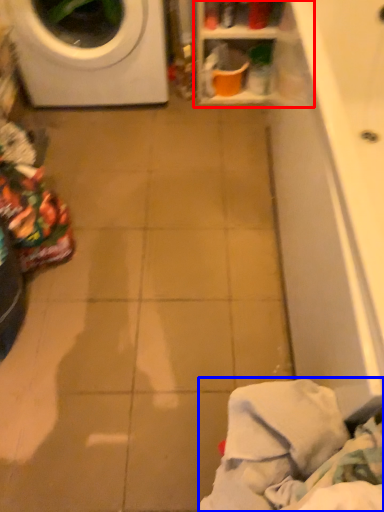
Question: Which object appears closest to the camera in this image, shelf (highlighted by a red box) or clothing (highlighted by a blue box)?

Choices:
 (A) shelf
 (B) clothing

Answer: (B)